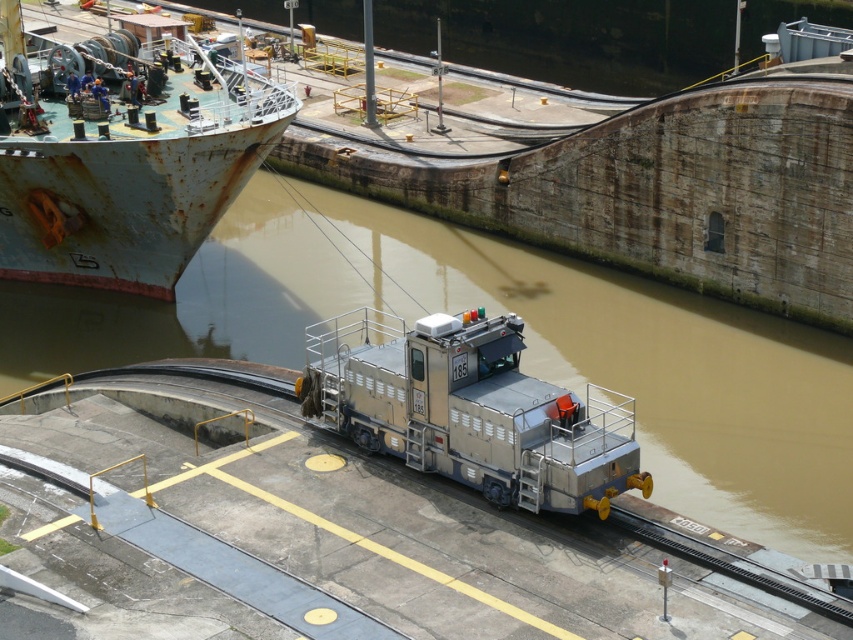
Is brown matte water at center to the left of metallic gray locomotive at center from the viewer's perspective?

Correct, you'll find brown matte water at center to the left of metallic gray locomotive at center.

Can you confirm if brown matte water at center is positioned below metallic gray locomotive at center?

No.

Between point (218, 310) and point (515, 340), which one is positioned in front?

Positioned in front is point (515, 340).

Identify the location of brown matte water at center. The height and width of the screenshot is (640, 853). (521, 355).

Between brown matte water at center and rusty metal ship at upper left, which one is positioned lower?

brown matte water at center is lower down.

Measure the distance between point (10,317) and camera.

Point (10,317) is 56.06 meters from camera.

Between point (627, 308) and point (177, 128), which one is positioned in front?

Point (177, 128)

The image size is (853, 640). What are the coordinates of `brown matte water at center` in the screenshot? It's located at (521, 355).

Is rusty metal ship at upper left closer to the viewer compared to metallic gray locomotive at center?

No, it is behind metallic gray locomotive at center.

In the scene shown: Is rusty metal ship at upper left thinner than metallic gray locomotive at center?

No.

Does point (13, 81) come farther from viewer compared to point (511, 346)?

Yes, point (13, 81) is farther from viewer.

The image size is (853, 640). Find the location of `rusty metal ship at upper left`. rusty metal ship at upper left is located at coordinates (131, 160).